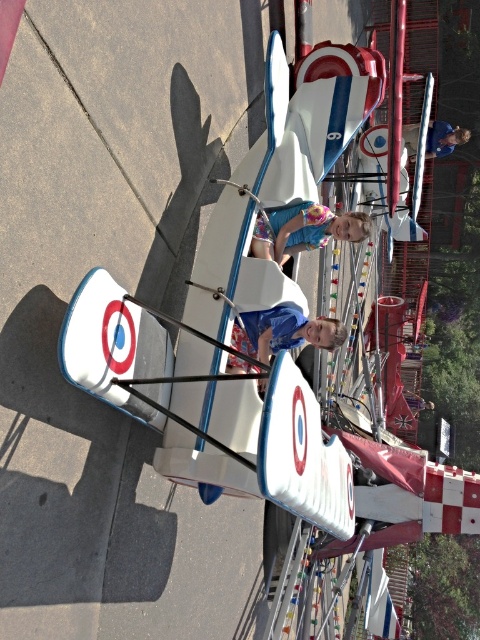
Can you confirm if matte blue dress at center is thinner than matte blue helmet at upper center?

Yes.

Does matte blue dress at center appear on the right side of matte blue helmet at upper center?

No, matte blue dress at center is not to the right of matte blue helmet at upper center.

This screenshot has width=480, height=640. What do you see at coordinates (304, 230) in the screenshot?
I see `matte blue dress at center` at bounding box center [304, 230].

What are the coordinates of `matte blue dress at center` in the screenshot? It's located at (304, 230).

Between blue matte shirt at center and matte blue helmet at upper center, which one is positioned higher?

Positioned higher is matte blue helmet at upper center.

Is blue matte shirt at center closer to the viewer compared to matte blue helmet at upper center?

Yes, blue matte shirt at center is closer to the viewer.

The width and height of the screenshot is (480, 640). What do you see at coordinates (283, 332) in the screenshot? I see `blue matte shirt at center` at bounding box center [283, 332].

Identify the location of blue matte shirt at center. This screenshot has width=480, height=640. (283, 332).

Who is taller, blue matte shirt at center or matte blue dress at center?

With more height is blue matte shirt at center.

Who is more distant from viewer, (278, 346) or (351, 227)?

The point (278, 346) is behind.

You are a GUI agent. You are given a task and a screenshot of the screen. Output one action in this format:
    pyautogui.click(x=<x>, y=<y>)
    Task: Click on the blue matte shirt at center
    The height and width of the screenshot is (640, 480).
    Given the screenshot: What is the action you would take?
    pyautogui.click(x=283, y=332)